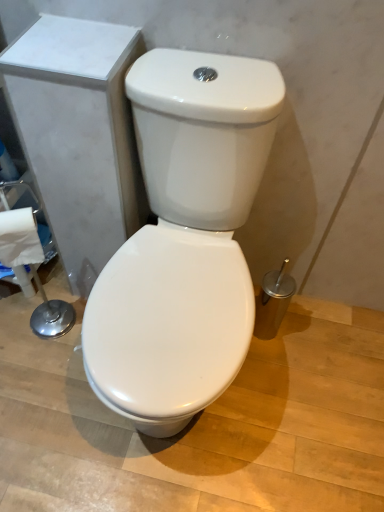
You are a GUI agent. You are given a task and a screenshot of the screen. Output one action in this format:
    pyautogui.click(x=<x>, y=<y>)
    Task: Click on the vacant space that is to the left of white glossy toilet at center
    The width and height of the screenshot is (384, 512).
    Given the screenshot: What is the action you would take?
    pyautogui.click(x=41, y=376)